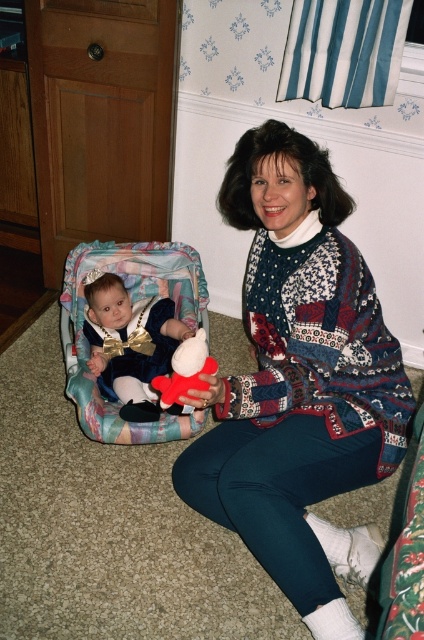
In the scene shown: You are a photographer setting up a shot in this scene. The velvet blue baby at left and the fluffy plush toy at center are both in frame. Based on their sizes, which object should you focus on if you want to highlight the smaller subject?

The fluffy plush toy at center should be focused on because it is smaller than the velvet blue baby at left.

You are a photographer setting up a shoot in the room. You need to place a small light to the right of the patterned sweater at center and to the left of the velvet blue baby at left. Is this possible based on their current positions?

The patterned sweater at center is positioned on the right side of the velvet blue baby at left, so placing a light to the right of the patterned sweater at center would also place it to the right of the velvet blue baby at left. Therefore, it is not possible to place the light between them as requested.